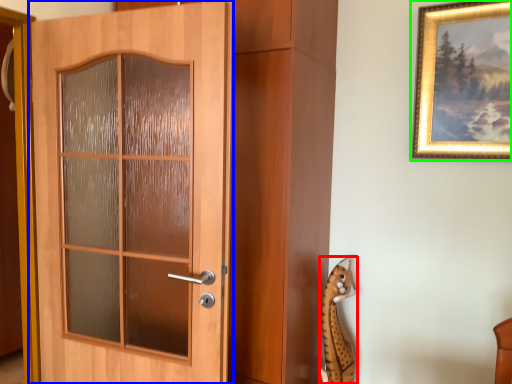
Question: Which object is the farthest from animal (highlighted by a red box)? Choose among these: door (highlighted by a blue box) or picture frame (highlighted by a green box).

Choices:
 (A) door
 (B) picture frame

Answer: (A)